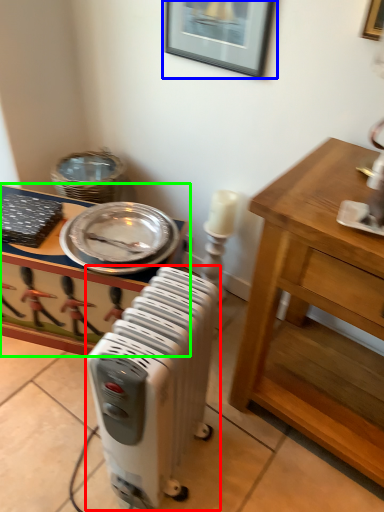
Question: Based on their relative distances, which object is farther from home appliance (highlighted by a red box)? Choose from picture frame (highlighted by a blue box) and desk (highlighted by a green box).

Choices:
 (A) picture frame
 (B) desk

Answer: (A)